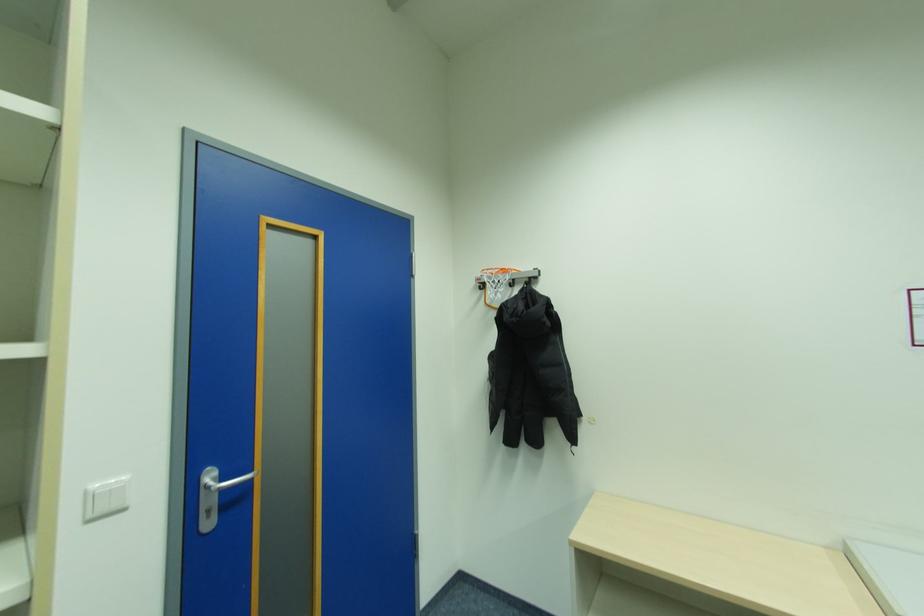
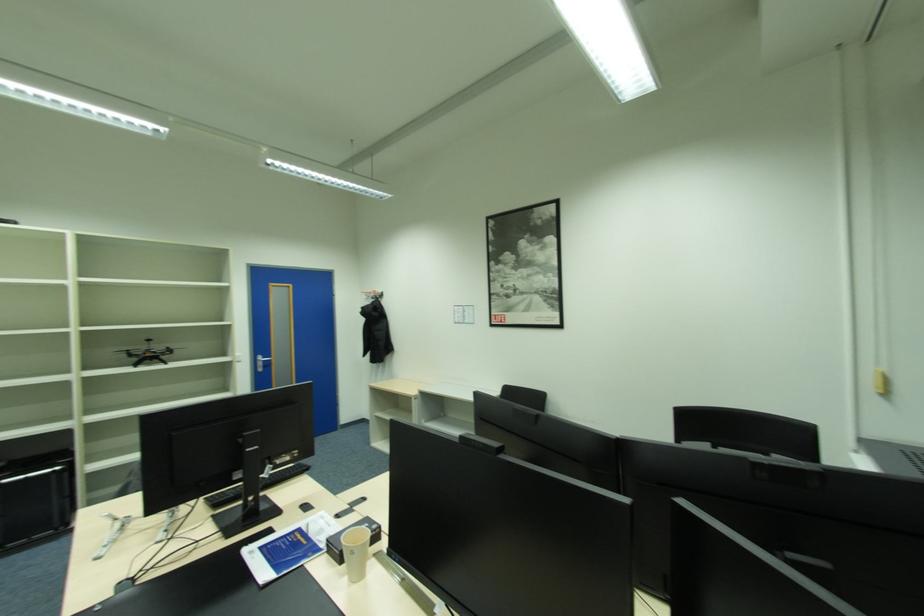
From the picture: What movement of the cameraman would produce the second image?

The movement direction of the cameraman is right, backward.